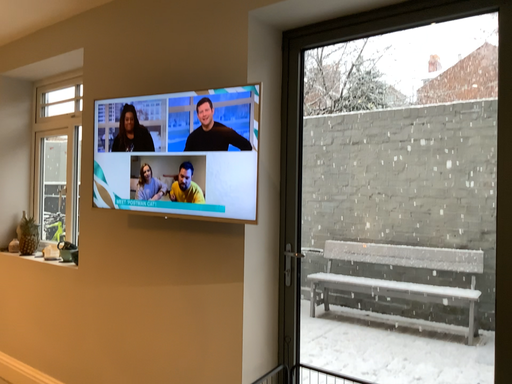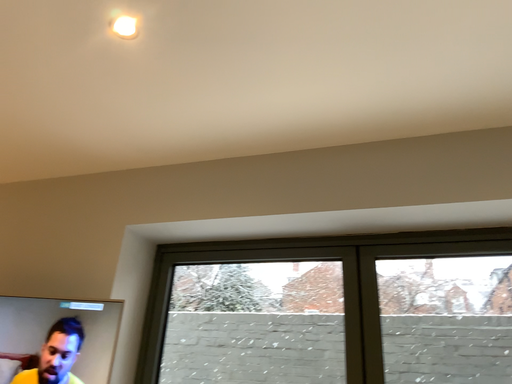
Question: Which way did the camera rotate in the video?

Choices:
 (A) rotated left
 (B) rotated right

Answer: (B)